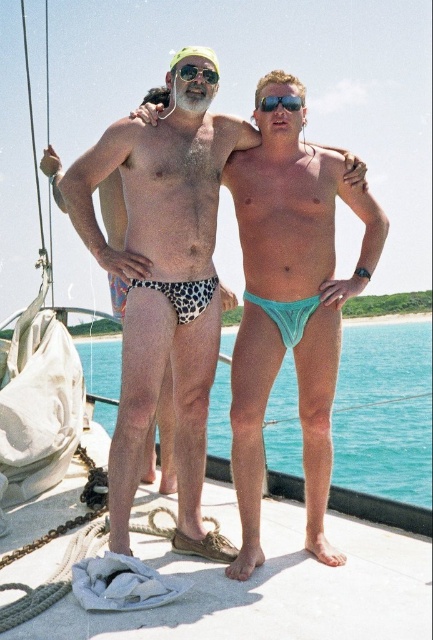
You are a photographer on the boat deck. You need to capture a photo where the teal fabric thong at center and the green plastic goggles at upper center are both visible. Which object will appear larger in the photo?

The teal fabric thong at center will appear larger in the photo because it is closer to the viewer than the green plastic goggles at upper center.

Based on the photo, you are a photographer trying to capture both the leopard print swim trunks at center and the teal fabric thong at center in a single frame. Since you want both to be fully visible, which one should you focus on adjusting the camera angle for, considering their heights?

The leopard print swim trunks at center is taller than the teal fabric thong at center. To ensure both are fully visible, adjust the camera angle to focus on the leopard print swim trunks at center, as it is taller and requires a higher angle to capture its full height without cropping the teal fabric thong at center.

You are on a boat deck and want to place a small flagpole at one of two specific points marked as point (187,381) and point (255,100). Which point is closer to you so the flagpole will be more visible?

Point (187,381) is closer to the viewer than point (255,100), so placing the flagpole there will make it more visible.